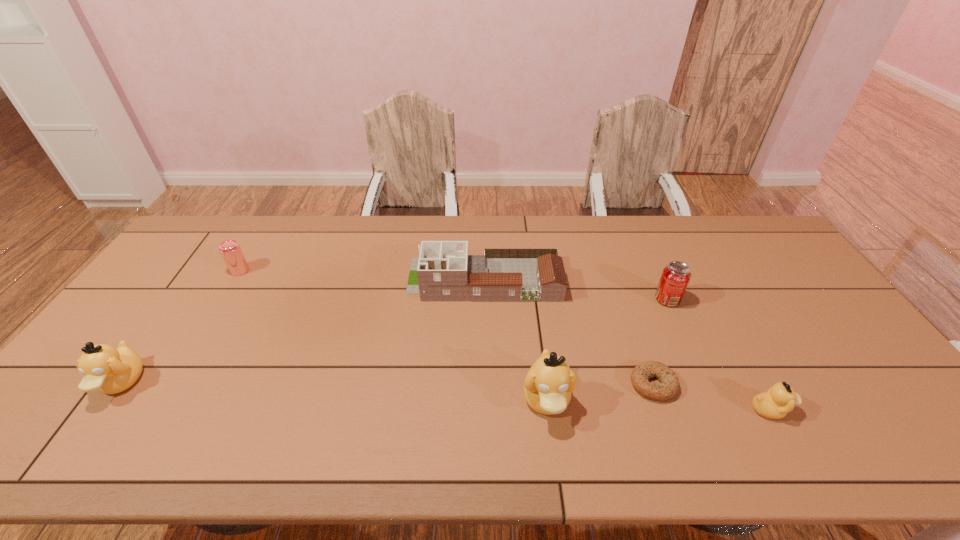
This screenshot has width=960, height=540. Find the location of `the leftmost object`. the leftmost object is located at coordinates (109, 370).

You are a GUI agent. You are given a task and a screenshot of the screen. Output one action in this format:
    pyautogui.click(x=<x>, y=<y>)
    Task: Click on the second shortest duckling
    The image size is (960, 540).
    Given the screenshot: What is the action you would take?
    pyautogui.click(x=109, y=370)

I want to click on the second duckling from right to left, so click(x=548, y=384).

Identify the location of the rightmost duckling. pyautogui.click(x=780, y=399).

Find the location of a particular element. the rightmost object is located at coordinates [x=780, y=399].

The image size is (960, 540). Identify the location of dollhouse. (444, 271).

Where is `beer can`? The image size is (960, 540). beer can is located at coordinates (230, 250).

You are a GUI agent. You are given a task and a screenshot of the screen. Output one action in this format:
    pyautogui.click(x=<x>, y=<y>)
    Task: Click on the soda can
    
    Given the screenshot: What is the action you would take?
    pyautogui.click(x=675, y=277)

The height and width of the screenshot is (540, 960). What are the coordinates of `the sixth object from left to right` in the screenshot? It's located at (675, 277).

The width and height of the screenshot is (960, 540). Find the location of `the shortest object`. the shortest object is located at coordinates (669, 386).